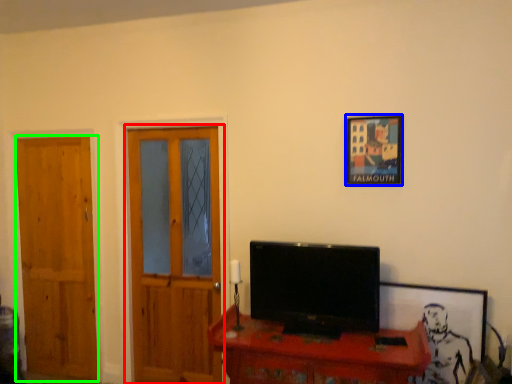
Question: Which object is the farthest from door (highlighted by a red box)? Choose among these: picture frame (highlighted by a blue box) or door (highlighted by a green box).

Choices:
 (A) picture frame
 (B) door

Answer: (A)